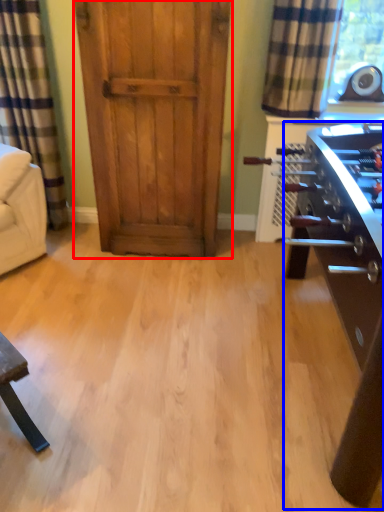
Question: Which object appears farthest to the camera in this image, door (highlighted by a red box) or table (highlighted by a blue box)?

Choices:
 (A) door
 (B) table

Answer: (A)